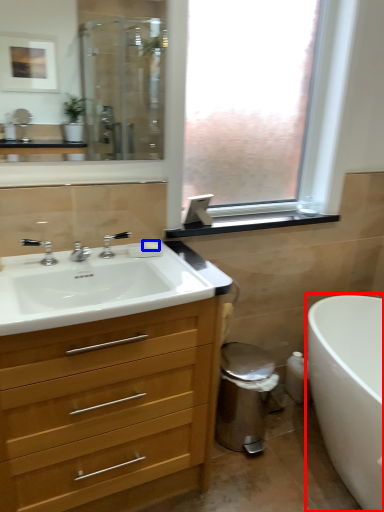
Question: Which point is further to the camera, bath (highlighted by a red box) or soap (highlighted by a blue box)?

Choices:
 (A) bath
 (B) soap

Answer: (B)